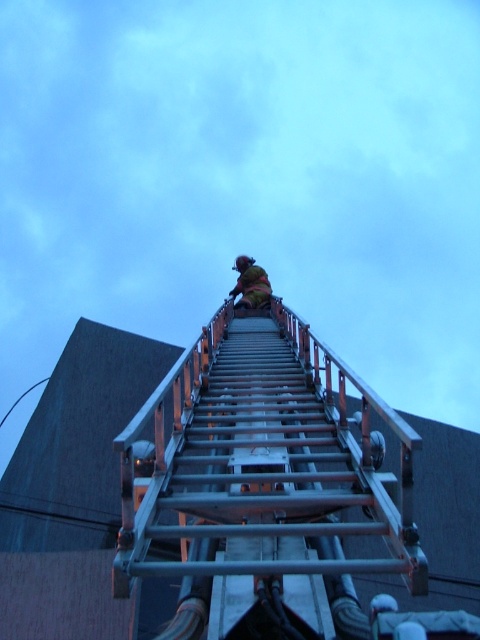
Question: Considering the relative positions of metallic silver ladder at upper center and yellow fabric at upper center in the image provided, where is metallic silver ladder at upper center located with respect to yellow fabric at upper center?

Choices:
 (A) above
 (B) below

Answer: (B)

Question: Among these objects, which one is nearest to the camera?

Choices:
 (A) yellow fabric at upper center
 (B) metallic silver ladder at upper center

Answer: (B)

Question: Which object appears closest to the camera in this image?

Choices:
 (A) metallic silver ladder at upper center
 (B) yellow fabric at upper center

Answer: (A)

Question: Is metallic silver ladder at upper center to the right of yellow fabric at upper center from the viewer's perspective?

Choices:
 (A) no
 (B) yes

Answer: (B)

Question: From the image, what is the correct spatial relationship of metallic silver ladder at upper center in relation to yellow fabric at upper center?

Choices:
 (A) right
 (B) left

Answer: (A)